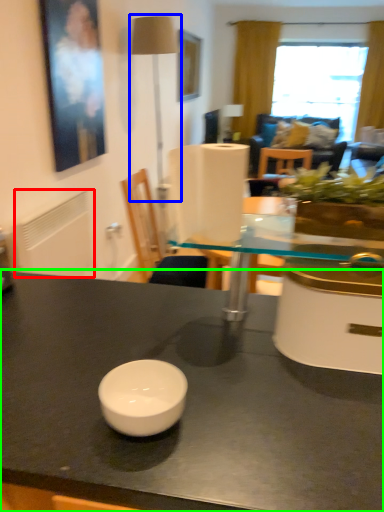
Question: Which object is the farthest from radiator (highlighted by a red box)? Choose among these: table lamp (highlighted by a blue box) or table (highlighted by a green box).

Choices:
 (A) table lamp
 (B) table

Answer: (A)